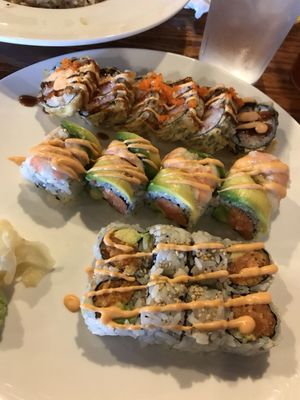
Where is `restaurant table`? restaurant table is located at coordinates (284, 89), (291, 46), (194, 43), (164, 41), (36, 56).